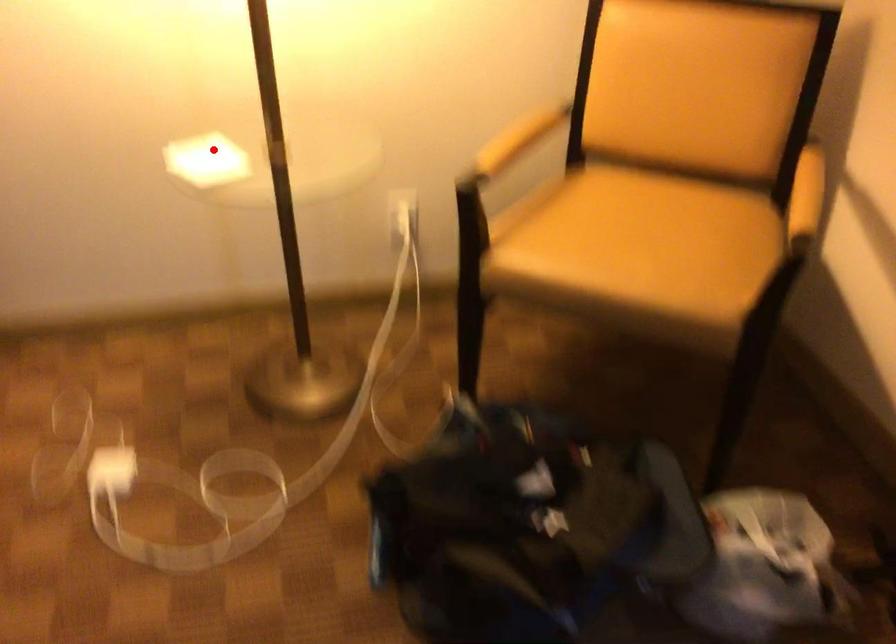
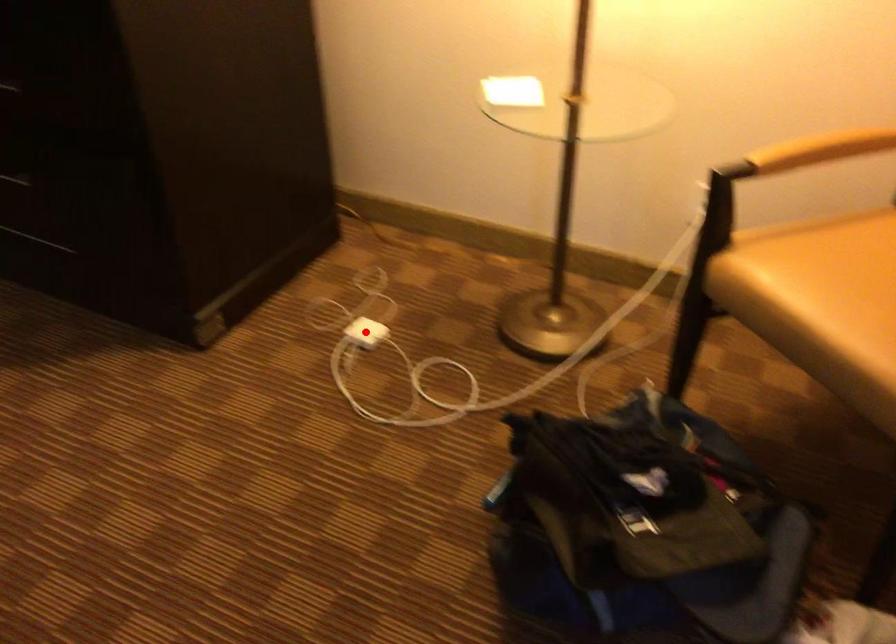
I am providing you with two images of the same scene from different viewpoints. A red point is marked on the first image and another point is marked on the second image. Is the red point in image1 aligned with the point shown in image2?

No